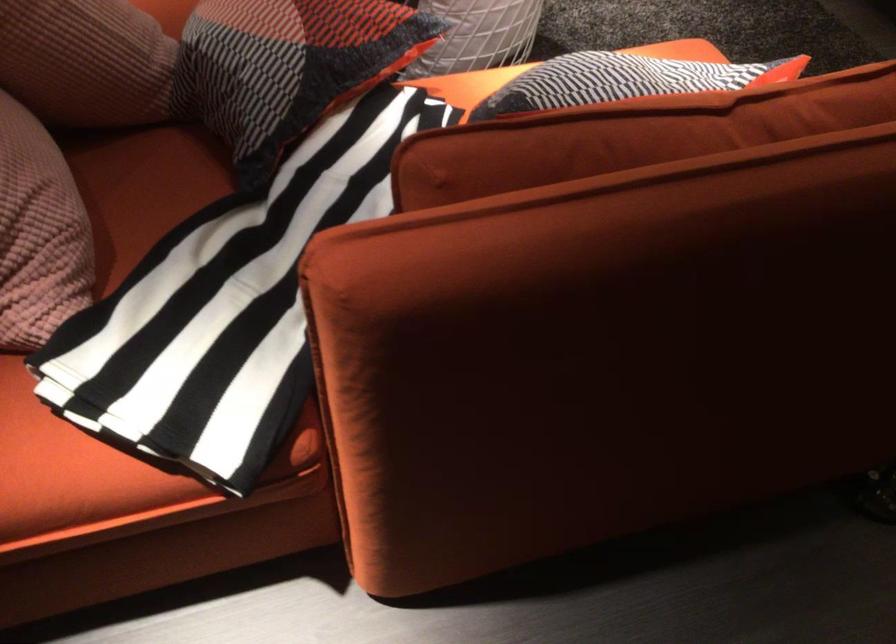
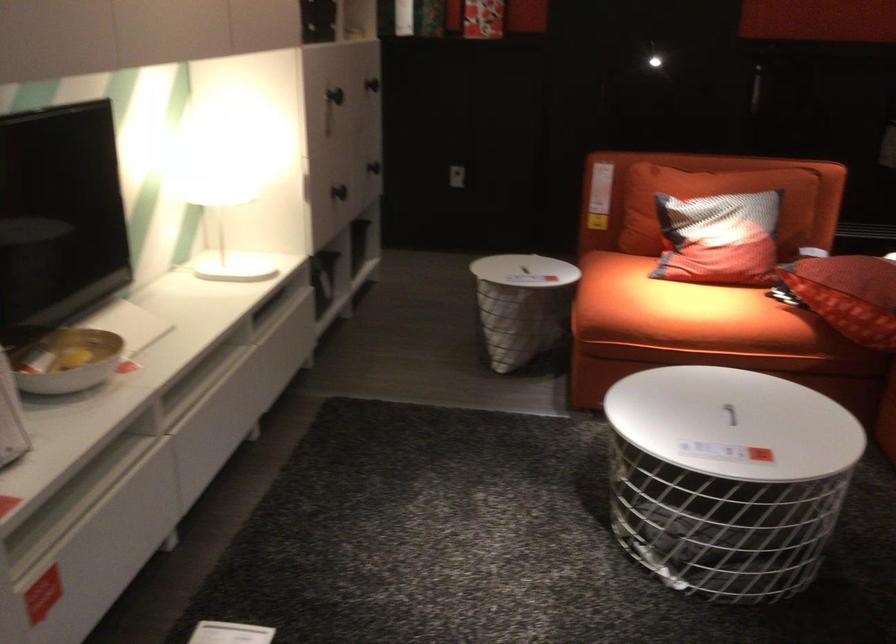
Question: I am providing you with two images of the same scene from different viewpoints. After the viewpoint changes to image2, which objects are now occluded?

Choices:
 (A) sofa armrest
 (B) red rectangular box
 (C) table lid handle
 (D) sofa sitting surface

Answer: (A)